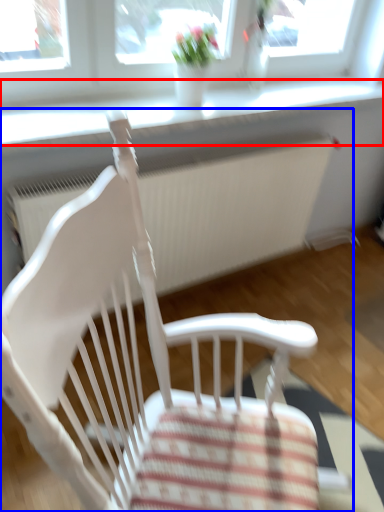
Question: Which object appears farthest to the camera in this image, window sill (highlighted by a red box) or chair (highlighted by a blue box)?

Choices:
 (A) window sill
 (B) chair

Answer: (A)